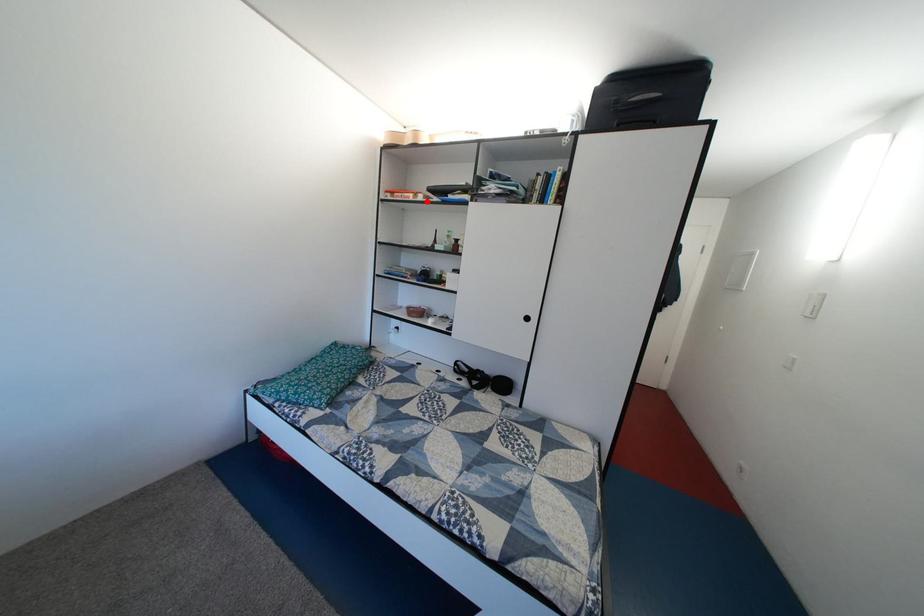
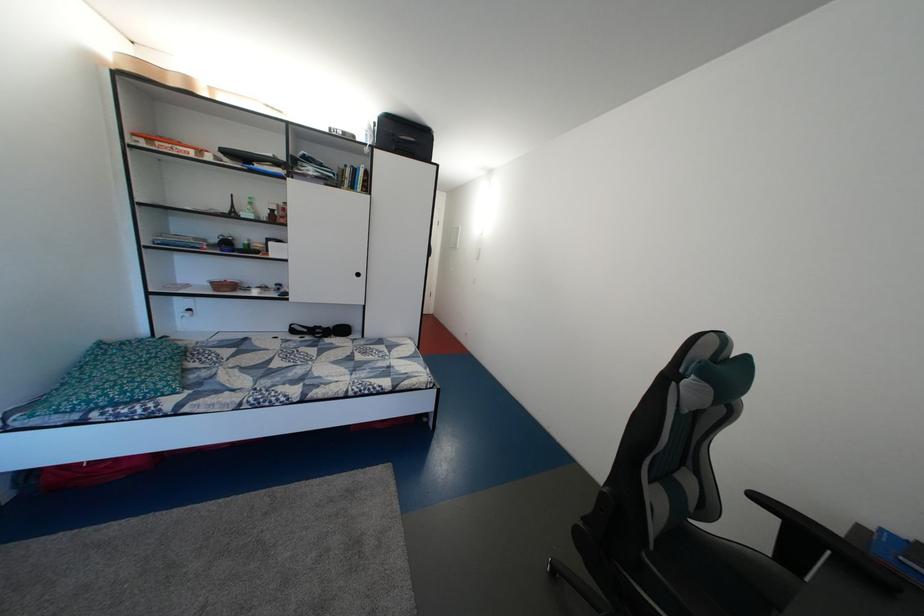
Find the pixel in the second image that matches the highlighted location in the first image.

(211, 159)